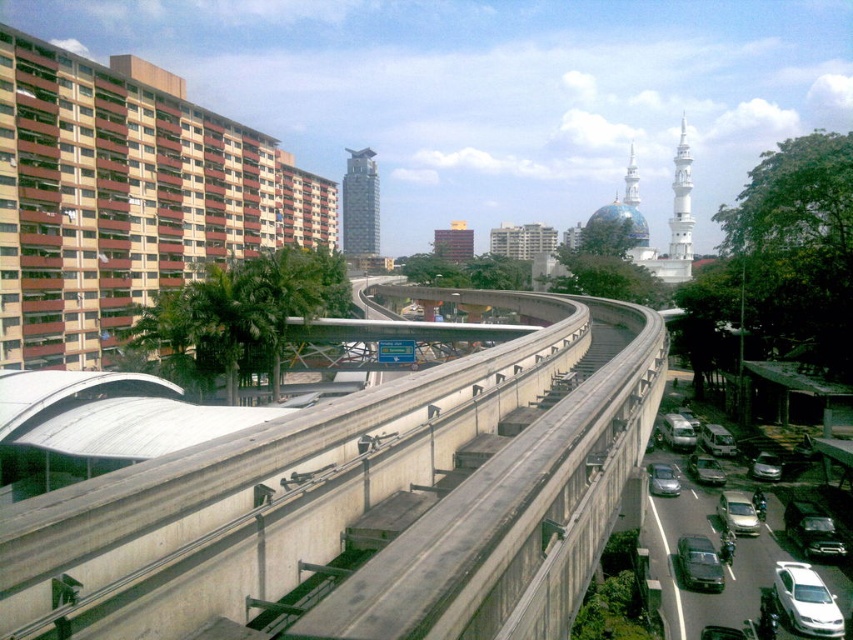
Can you confirm if silver metallic sedan at lower right is positioned to the left of shiny black car at lower right?

Yes, silver metallic sedan at lower right is to the left of shiny black car at lower right.

What do you see at coordinates (712, 547) in the screenshot?
I see `silver metallic sedan at lower right` at bounding box center [712, 547].

I want to click on silver metallic sedan at lower right, so click(712, 547).

Describe the element at coordinates (682, 202) in the screenshot. The width and height of the screenshot is (853, 640). I see `white marble minaret at upper right` at that location.

Is point (685, 134) closer to camera compared to point (689, 566)?

No, (685, 134) is behind (689, 566).

The image size is (853, 640). What do you see at coordinates (682, 202) in the screenshot?
I see `white marble minaret at upper right` at bounding box center [682, 202].

Where is `white marble minaret at upper right`? The image size is (853, 640). white marble minaret at upper right is located at coordinates (682, 202).

Does metallic glass tower at center appear on the right side of matte black sedan at center?

In fact, metallic glass tower at center is to the left of matte black sedan at center.

Is point (370, 154) behind point (683, 579)?

That is True.

I want to click on metallic glass tower at center, so click(x=360, y=204).